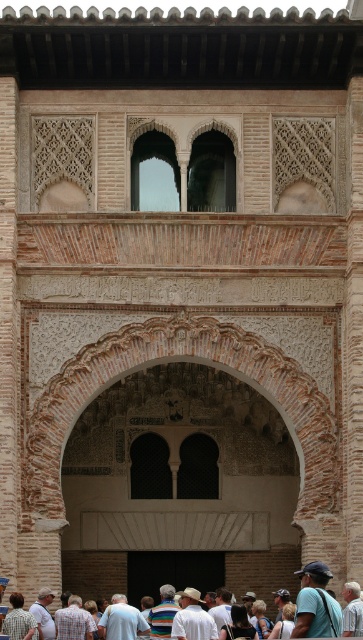
Who is lower down, light blue shirt at lower left or white cotton shirt at center?

white cotton shirt at center is below.

Does light blue shirt at lower left have a smaller size compared to white cotton shirt at center?

Yes, light blue shirt at lower left is smaller than white cotton shirt at center.

Which is behind, point (37, 636) or point (226, 628)?

The point (37, 636) is more distant.

Identify the location of light blue shirt at lower left. (18, 620).

Is light blue shirt at lower left above white cotton shirt at lower center?

Indeed, light blue shirt at lower left is positioned over white cotton shirt at lower center.

Who is more distant from viewer, (34, 625) or (292, 620)?

Positioned behind is point (292, 620).

This screenshot has height=640, width=363. In order to click on light blue shirt at lower left in this screenshot , I will do `click(18, 620)`.

Who is higher up, white cotton shirt at center or white cotton shirt at lower center?

white cotton shirt at center is above.

Does white cotton shirt at center appear over white cotton shirt at lower center?

Yes, white cotton shirt at center is above white cotton shirt at lower center.

Is point (250, 637) positioned behind point (292, 604)?

No, it is in front of (292, 604).

I want to click on white cotton shirt at center, so click(238, 625).